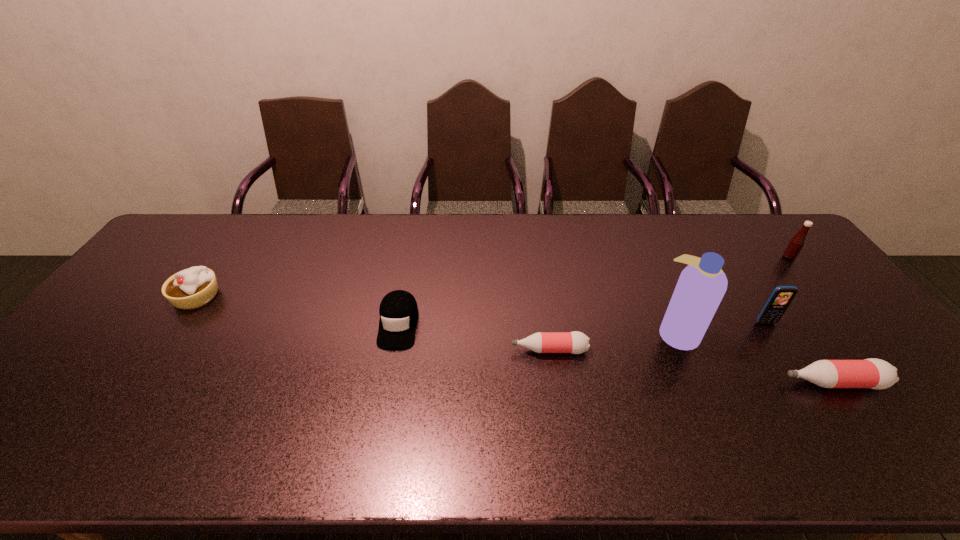
Where is `free spot located 0.380m on the back of the fourth object from left to right`? Image resolution: width=960 pixels, height=540 pixels. free spot located 0.380m on the back of the fourth object from left to right is located at coordinates (635, 235).

Identify the location of free space located on the screen of the cellular telephone. The image size is (960, 540). (792, 363).

Find the location of a particular element. The height and width of the screenshot is (540, 960). vacant space located 0.200m on the front-facing side of the sixth object from right to left is located at coordinates (381, 419).

Locate an element on the screen. object that is at the far edge is located at coordinates (796, 244).

This screenshot has width=960, height=540. Find the location of `object that is positioned at the near edge`. object that is positioned at the near edge is located at coordinates (872, 373).

Where is `object located in the left edge section of the desktop`? The width and height of the screenshot is (960, 540). object located in the left edge section of the desktop is located at coordinates (191, 288).

Image resolution: width=960 pixels, height=540 pixels. What are the coordinates of `bottle present at the right edge` in the screenshot? It's located at (872, 373).

You are a GUI agent. You are given a task and a screenshot of the screen. Output one action in this format:
    pyautogui.click(x=<x>, y=<y>)
    Task: Click on the Tabasco sauce located at the right edge
    
    Given the screenshot: What is the action you would take?
    pyautogui.click(x=796, y=244)

At what (x,y) coordinates should I click in order to perform the action: click on object at the far right corner. Please return your answer as a coordinate pair (x, y). Image resolution: width=960 pixels, height=540 pixels. Looking at the image, I should click on (796, 244).

Locate an element on the screen. The width and height of the screenshot is (960, 540). object that is at the near right corner is located at coordinates (872, 373).